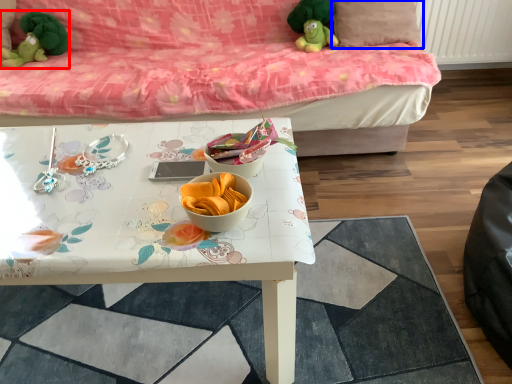
Question: Which object is further to the camera taking this photo, toy (highlighted by a red box) or pillow (highlighted by a blue box)?

Choices:
 (A) toy
 (B) pillow

Answer: (A)